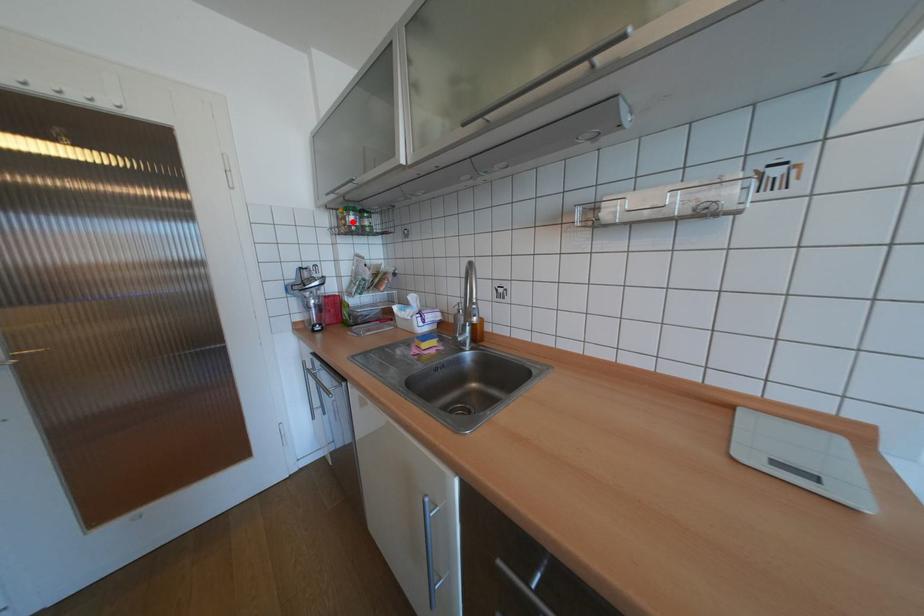
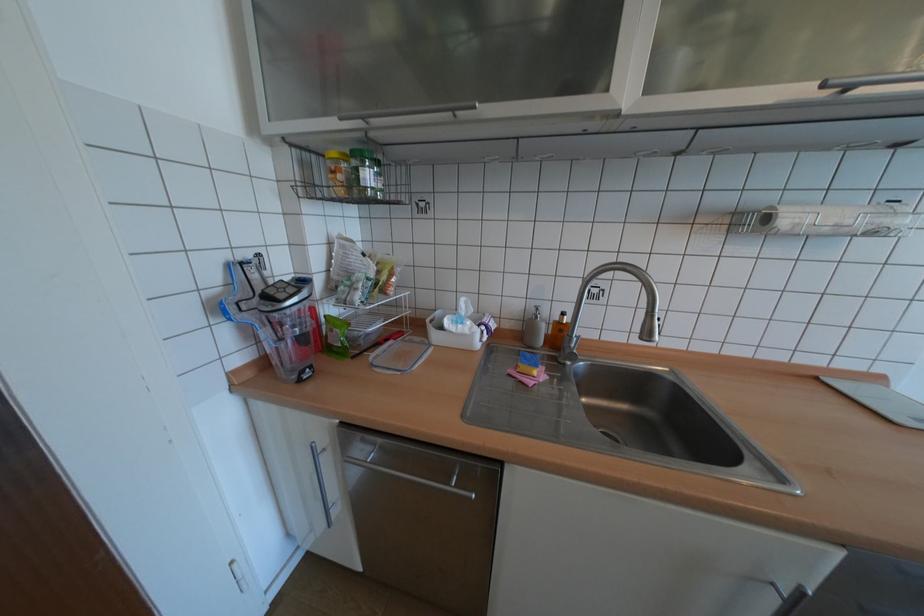
Question: I am providing you with two images of the same scene from different viewpoints. A red point is marked on the first image. At the location where the point appears in image 1, is it still visible in image 2?

Choices:
 (A) Yes
 (B) No

Answer: (A)